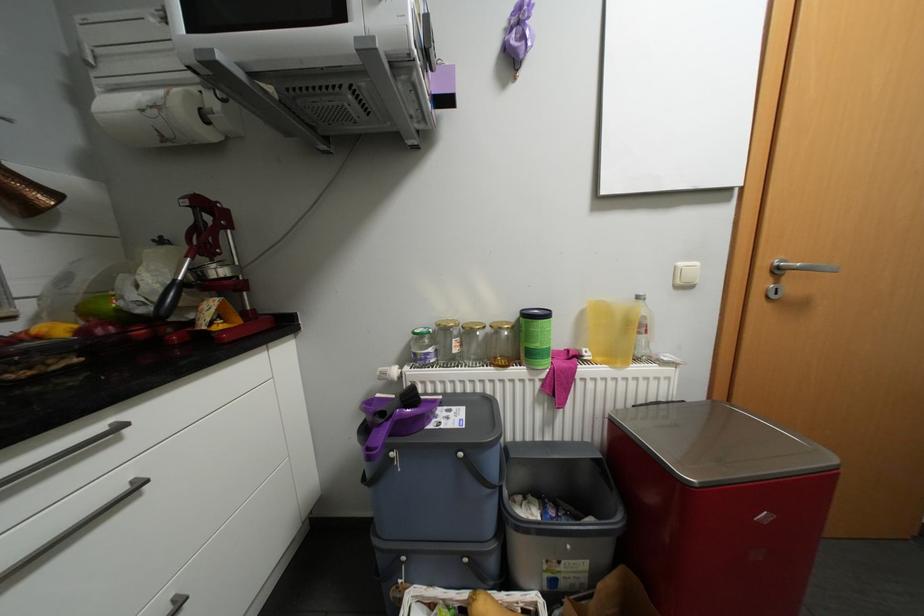
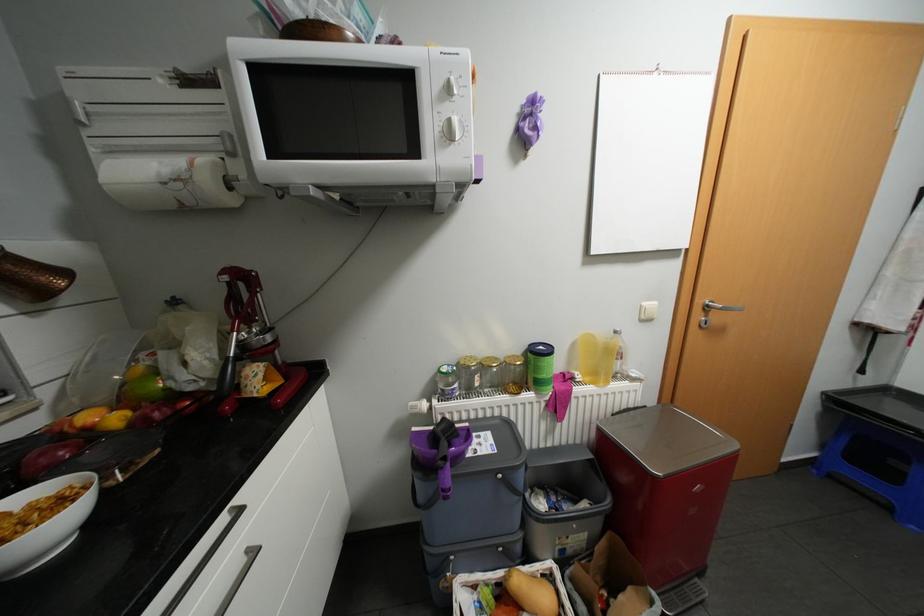
Where in the second image is the point corresponding to point 537,367 from the first image?

(544, 392)